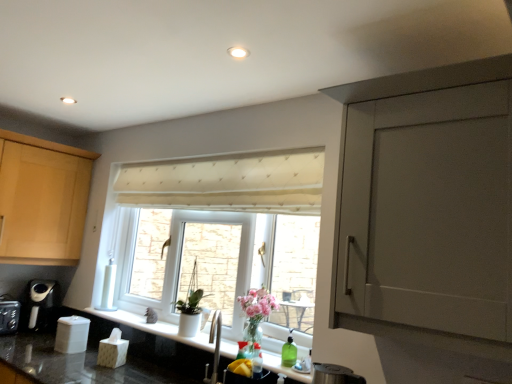
Question: Is cream quilted curtain at center taller or shorter than white matte pot at window?

Choices:
 (A) tall
 (B) short

Answer: (B)

Question: Considering the positions of point (245, 195) and point (189, 301), is point (245, 195) closer or farther from the camera than point (189, 301)?

Choices:
 (A) farther
 (B) closer

Answer: (B)

Question: Which is nearer to the black plastic coffee machine at lower left?

Choices:
 (A) cream quilted curtain at center
 (B) matte gray cabinet door at right
 (C) matte wood cabinet at left
 (D) clear glass vase at lower center
 (E) white textured window at center

Answer: (C)

Question: Which object is the farthest from the matte gray cabinet door at right?

Choices:
 (A) black plastic coffee machine at lower left
 (B) white matte pot at window
 (C) black granite countertop at lower center
 (D) clear glass vase at lower center
 (E) matte wood cabinet at left

Answer: (A)